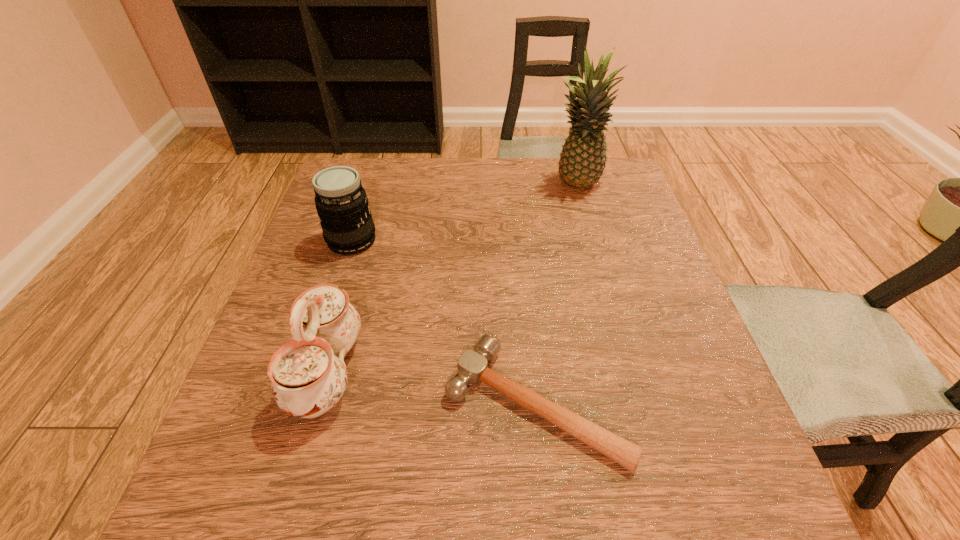
The width and height of the screenshot is (960, 540). Find the location of `pineapple`. pineapple is located at coordinates (582, 161).

Identify the location of the farthest object. (582, 161).

At what (x,y) coordinates should I click in order to perform the action: click on the third nearest object. Please return your answer as a coordinate pair (x, y). The height and width of the screenshot is (540, 960). Looking at the image, I should click on (341, 202).

Identify the location of chinaware. Image resolution: width=960 pixels, height=540 pixels. (308, 379).

I want to click on hammer, so click(472, 368).

What are the coordinates of `vacant space located on the left of the farthest object` in the screenshot? It's located at (492, 184).

I want to click on blank space located 0.380m on the right of the telephoto lens, so click(540, 241).

Locate an element on the screen. The height and width of the screenshot is (540, 960). vacant space located by the handle of the chinaware is located at coordinates (404, 371).

What are the coordinates of `vacant space located 0.090m on the back of the hammer` in the screenshot? It's located at click(526, 308).

The height and width of the screenshot is (540, 960). In order to click on object situated at the far edge in this screenshot , I will do `click(582, 161)`.